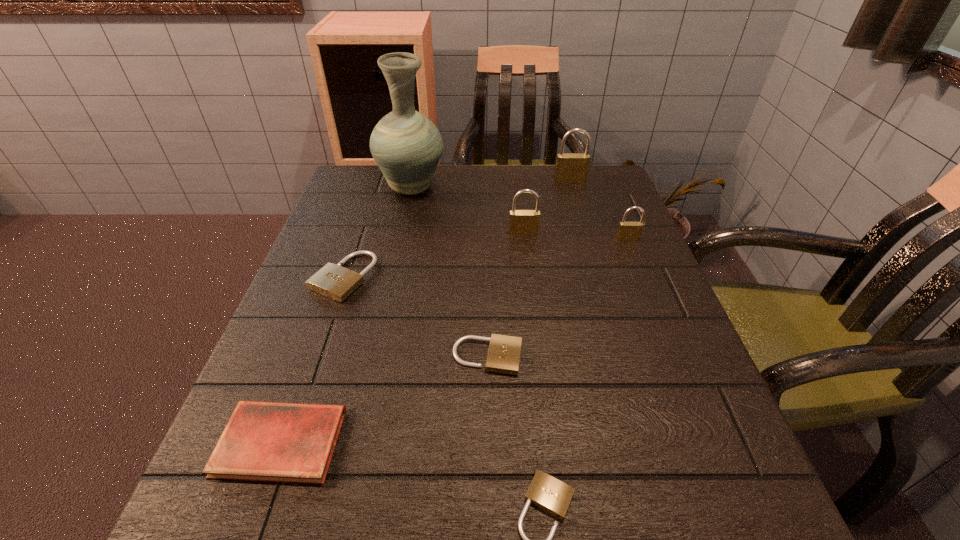
This screenshot has height=540, width=960. Identify the location of pitcher present at the left edge. (406, 145).

This screenshot has width=960, height=540. Identify the location of padlock at the left edge. (336, 282).

You are a GUI agent. You are given a task and a screenshot of the screen. Output one action in this format:
    pyautogui.click(x=<x>, y=<y>)
    Task: Click on the diary present at the left edge
    The height and width of the screenshot is (540, 960).
    Given the screenshot: What is the action you would take?
    pyautogui.click(x=263, y=441)

Where is `object that is at the far left corner`? The width and height of the screenshot is (960, 540). object that is at the far left corner is located at coordinates (406, 145).

Identify the location of object at the far right corner. (570, 167).

Image resolution: width=960 pixels, height=540 pixels. Identify the location of vacant position at the far edge of the desktop. (558, 192).

Locate an element on the screen. free location at the near edge is located at coordinates click(x=492, y=521).

This screenshot has height=540, width=960. I want to click on free spot at the left edge of the desktop, so click(x=277, y=401).

The height and width of the screenshot is (540, 960). In the image, there is a desktop. Find the location of `vacant space at the right edge`. vacant space at the right edge is located at coordinates (633, 307).

The height and width of the screenshot is (540, 960). What are the coordinates of `free space at the far left corner of the desktop` in the screenshot? It's located at (369, 183).